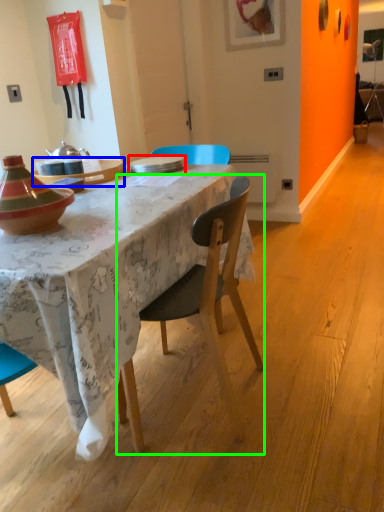
Question: Which is farther away from plate (highlighted by a red box)? table (highlighted by a blue box) or chair (highlighted by a green box)?

Choices:
 (A) table
 (B) chair

Answer: (B)